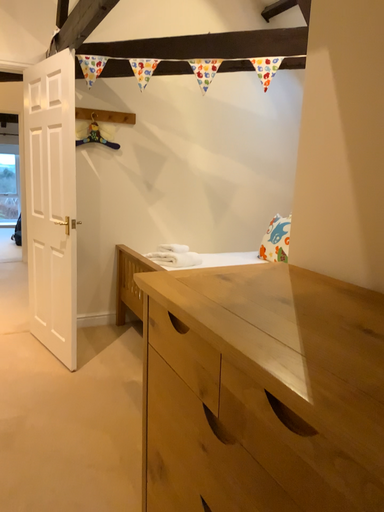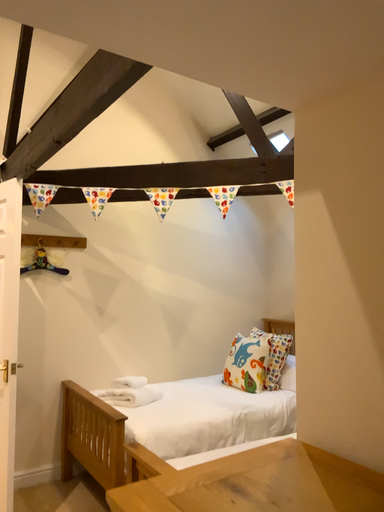
Question: How did the camera likely rotate when shooting the video?

Choices:
 (A) rotated downward
 (B) rotated upward

Answer: (B)